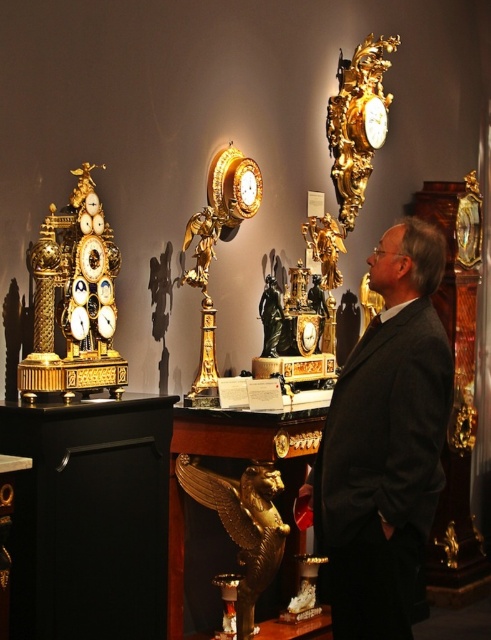
Question: Can you confirm if gold/gilded clock at center is positioned to the left of gold/gilded ornate clock at upper right?

Choices:
 (A) no
 (B) yes

Answer: (B)

Question: Does black suit at center appear on the left side of gold/gilded clock at center?

Choices:
 (A) yes
 (B) no

Answer: (B)

Question: Which object is farther from the camera taking this photo?

Choices:
 (A) gold/gilded clock at center
 (B) gold polished eagle at center
 (C) gold/gilded clock at left
 (D) gold/gilded ornate clock at upper right

Answer: (D)

Question: Which point is farther from the camera taking this photo?

Choices:
 (A) (289, 531)
 (B) (377, 124)
 (C) (115, 246)

Answer: (B)

Question: Can you confirm if gold/gilded clock at left is smaller than gold/gilded clock at center?

Choices:
 (A) yes
 (B) no

Answer: (B)

Question: Estimate the real-world distances between objects in this image. Which object is closer to the black suit at center?

Choices:
 (A) gold polished eagle at center
 (B) gold/gilded clock at left
 (C) gold/gilded clock at center
 (D) gold/gilded ornate clock at upper right

Answer: (A)